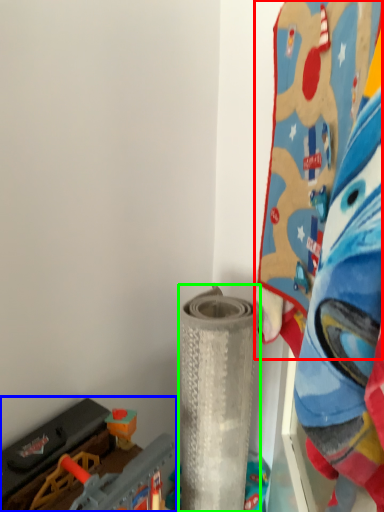
Question: Which object is positioned closest to toy (highlighted by a red box)? Select from toy (highlighted by a blue box) and toy (highlighted by a green box).

Choices:
 (A) toy
 (B) toy

Answer: (B)